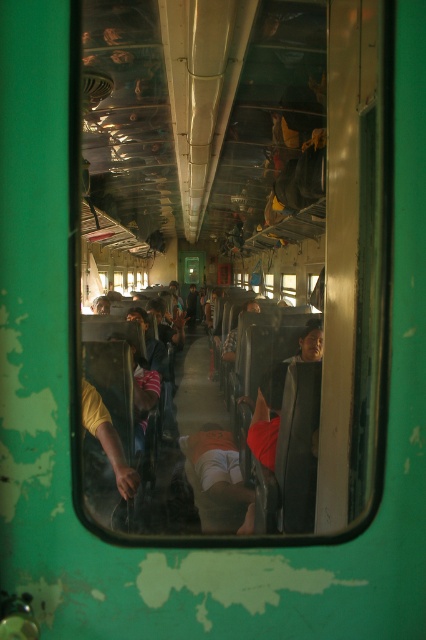
Question: In this image, where is transparent glass train window at center located relative to transparent glass window at center?

Choices:
 (A) below
 (B) above

Answer: (B)

Question: Can you confirm if transparent glass train window at center is wider than transparent glass window at center?

Choices:
 (A) yes
 (B) no

Answer: (A)

Question: Which point appears farthest from the camera in this image?

Choices:
 (A) (293, 284)
 (B) (190, 296)

Answer: (B)

Question: Estimate the real-world distances between objects in this image. Which object is farther from the transparent glass window at center?

Choices:
 (A) transparent glass train window at center
 (B) orange fabric shirt at center

Answer: (B)

Question: Observing the image, what is the correct spatial positioning of transparent glass train window at center in reference to transparent glass window at center?

Choices:
 (A) right
 (B) left

Answer: (B)

Question: Based on their relative distances, which object is nearer to the orange fabric shirt at center?

Choices:
 (A) transparent glass train window at center
 (B) transparent glass window at center

Answer: (B)